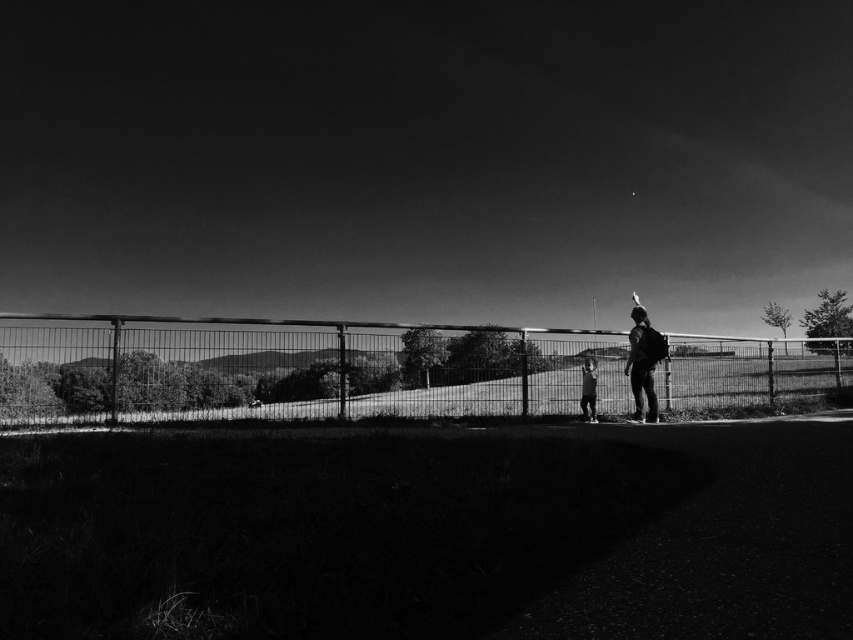
You are standing at the entrance of the park and want to reach the metallic fence at center. According to the image, in which direction should you walk to reach it?

The metallic fence at center is located at point 0.248 on the horizontal axis, which means it is positioned slightly to the left of the center. Therefore, you should walk towards the left from your current position at the entrance to reach the metallic fence at center.

You are standing at the point with coordinates point (318,392) and want to walk to the point with coordinates point (602,99). Is the point you want to reach located behind you or in front of you?

The point (602,99) is behind point (318,392), so the destination is behind you.

In the black and white photo, there is a metallic wire fence at center and a smooth skin child at center. Which object is positioned to the left in the image?

The metallic wire fence at center is to the left of the smooth skin child at center.